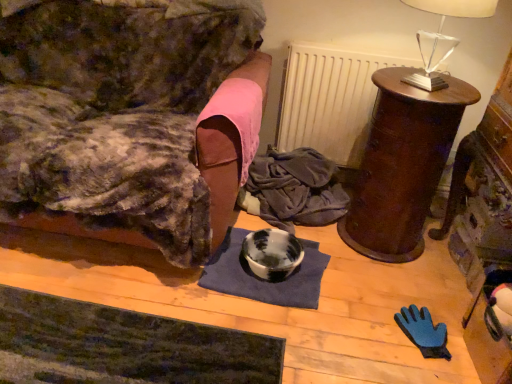
Question: Is blue fabric mat at center wider or thinner than clear glass table lamp at upper right?

Choices:
 (A) thin
 (B) wide

Answer: (B)

Question: Relative to clear glass table lamp at upper right, is blue fabric mat at center in front or behind?

Choices:
 (A) front
 (B) behind

Answer: (B)

Question: Estimate the real-world distances between objects in this image. Which object is closer to the clear glass table lamp at upper right?

Choices:
 (A) mahogany wood side table at right, which ranks as the first furniture in right-to-left order
 (B) velvet couch at left, placed as the 2th furniture when sorted from right to left
 (C) blue fabric mat at center
 (D) white matte radiator at upper center
 (E) dark blue fabric at center

Answer: (A)

Question: Which object is the farthest from the blue fabric mat at center?

Choices:
 (A) white matte radiator at upper center
 (B) dark green textured yoga mat at lower left
 (C) clear glass table lamp at upper right
 (D) marbled ceramic bowl at center
 (E) velvet couch at left, placed as the 2th furniture when sorted from right to left

Answer: (C)